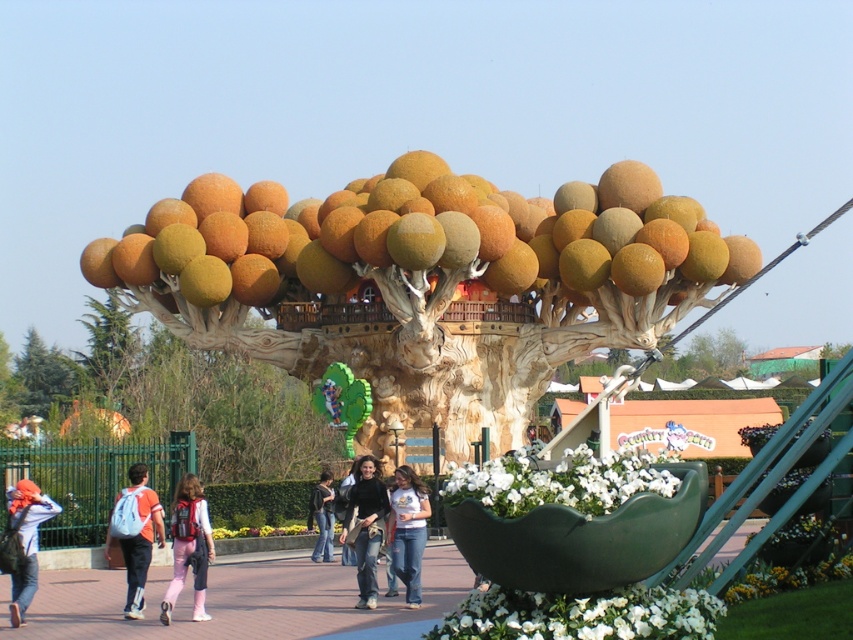
Question: Which point is farther from the camera taking this photo?

Choices:
 (A) (42, 520)
 (B) (119, 372)

Answer: (B)

Question: Which object is positioned closest to the denim jacket at lower left?

Choices:
 (A) matte pink pants at center
 (B) denim jeans at center
 (C) green leafy tree at left

Answer: (A)

Question: Considering the relative positions of matte pink pants at center and denim jacket at center in the image provided, where is matte pink pants at center located with respect to denim jacket at center?

Choices:
 (A) right
 (B) left

Answer: (B)

Question: Which point is farther to the camera?

Choices:
 (A) (421, 520)
 (B) (373, 582)

Answer: (A)

Question: Does matte orange spheres at center have a greater width compared to denim jacket at center?

Choices:
 (A) yes
 (B) no

Answer: (A)

Question: Can you confirm if dark brown leather jacket at center is positioned to the right of light blue backpack at lower left?

Choices:
 (A) yes
 (B) no

Answer: (A)